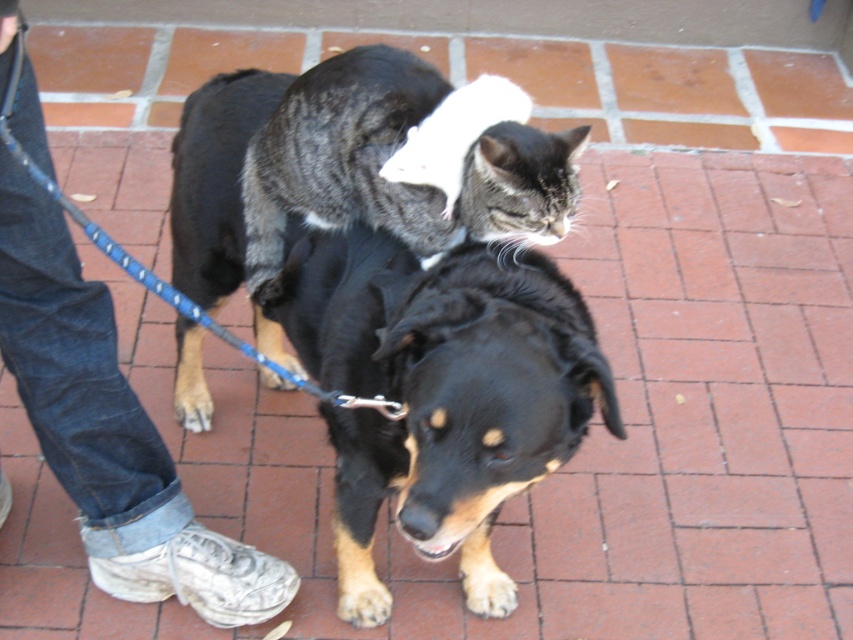
Question: Which point appears closest to the camera in this image?

Choices:
 (A) (543, 144)
 (B) (524, 314)
 (C) (113, 508)

Answer: (B)

Question: In this image, where is jeans at lower left located relative to tabby fur cat at center?

Choices:
 (A) below
 (B) above

Answer: (A)

Question: Can you confirm if jeans at lower left is positioned below tabby fur cat at center?

Choices:
 (A) no
 (B) yes

Answer: (B)

Question: Which object is the farthest from the black fur dog at center?

Choices:
 (A) tabby fur cat at center
 (B) jeans at lower left

Answer: (B)

Question: Which point appears closest to the camera in this image?

Choices:
 (A) (337, 195)
 (B) (57, 422)

Answer: (A)

Question: Does black fur dog at center come in front of jeans at lower left?

Choices:
 (A) no
 (B) yes

Answer: (A)